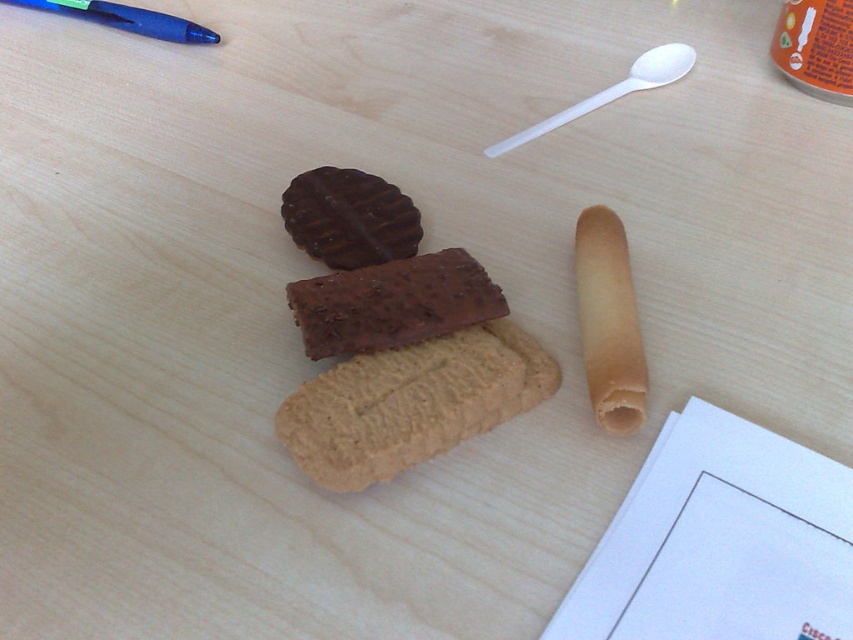
What is located at the point marked by the coordinates (410, 403) on the table?

The point marked by the coordinates (410, 403) is located at the golden textured cookie at center.

You are placing a small toy car on the table and want to position it between the golden textured cookie at center and the chocolatesmoothbar at center. Based on their positions, which cookie should you place the toy car to the right of?

The golden textured cookie at center is positioned on the right side of chocolatesmoothbar at center, so you should place the toy car to the right of the chocolatesmoothbar at center.

Looking at the light wooden table, you see a chocolate matte cookie at upper center and a blue plastic pen at upper left. Which object is positioned to the right of the other?

The chocolate matte cookie at upper center is to the right of the blue plastic pen at upper left.